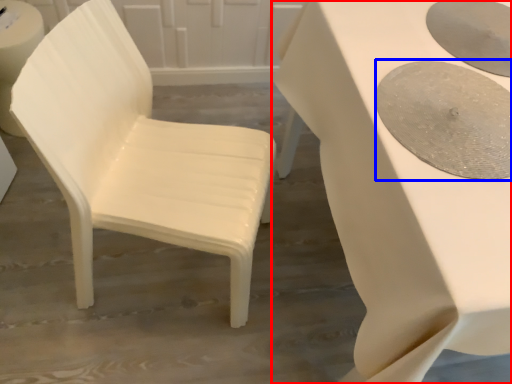
Question: Which point is further to the camera, table (highlighted by a red box) or oval (highlighted by a blue box)?

Choices:
 (A) table
 (B) oval

Answer: (B)